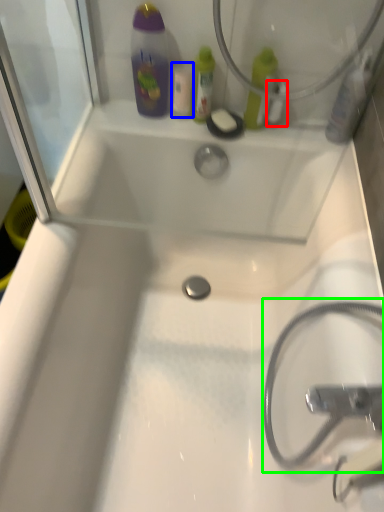
Question: Estimate the real-world distances between objects in this image. Which object is closer to mouthwash (highlighted by a red box), mouthwash (highlighted by a blue box) or garden hose (highlighted by a green box)?

Choices:
 (A) mouthwash
 (B) garden hose

Answer: (A)